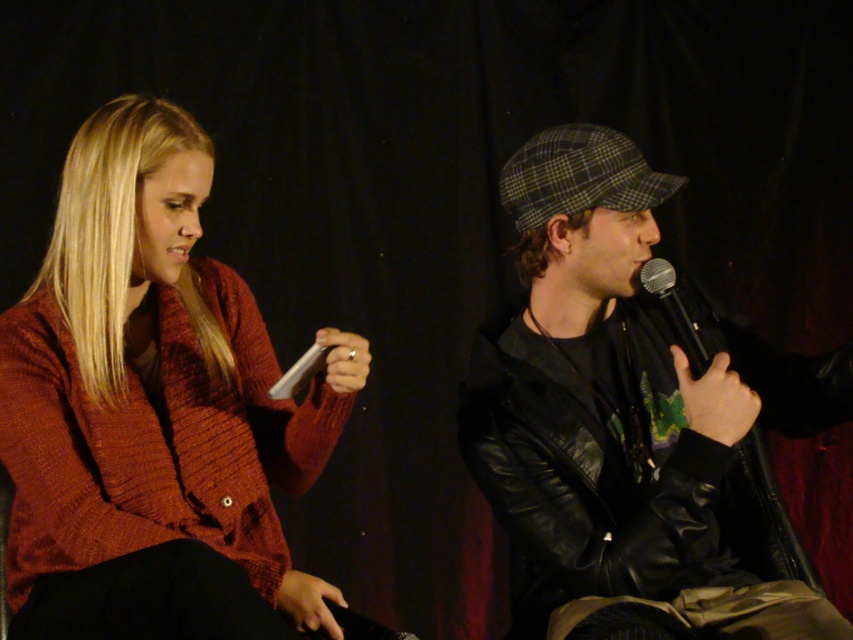
You are an event organizer who needs to adjust seating arrangements. If you want to move the knitted wool sweater at left closer to the leather jacket at center, which direction should you move it?

The knitted wool sweater at left is already in front of the leather jacket at center, so moving it closer would require moving it backward towards the leather jacket at center.

You are organizing a photo shoot and need to ensure that the knitted wool sweater at left and the black metallic microphone at center are visible in the frame. Based on their sizes, which object should you prioritize positioning closer to the camera to maintain clarity?

The knitted wool sweater at left is wider than the black metallic microphone at center, so you should prioritize positioning the knitted wool sweater at left closer to the camera to maintain clarity.

You are a photographer setting up for a panel discussion. You have a camera that can focus on objects within 3 feet. You see the knitted wool sweater at left. Will the sweater be in focus?

The knitted wool sweater at left is 3.75 feet away from the camera, which is beyond the 3 feet focus range. Therefore, the sweater will not be in focus.